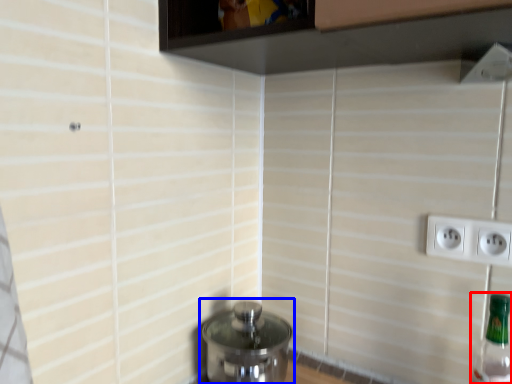
Question: Which object appears farthest to the camera in this image, bottle (highlighted by a red box) or water heater (highlighted by a blue box)?

Choices:
 (A) bottle
 (B) water heater

Answer: (B)